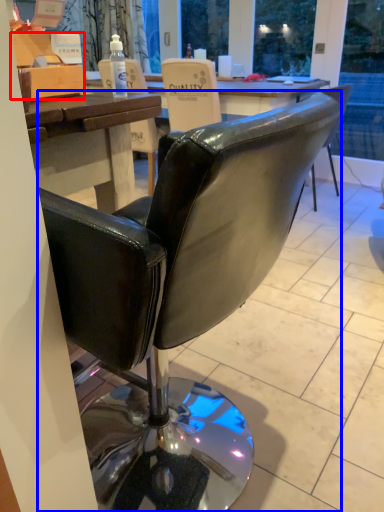
Question: Which object is further to the camera taking this photo, box (highlighted by a red box) or chair (highlighted by a blue box)?

Choices:
 (A) box
 (B) chair

Answer: (A)